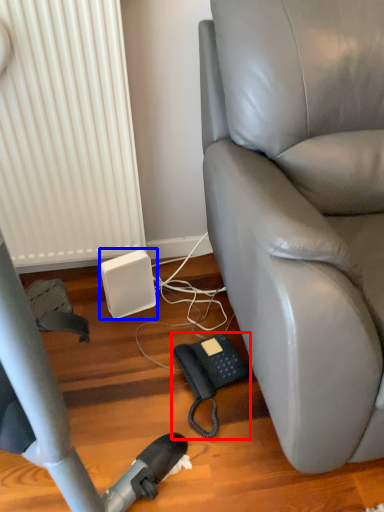
Question: Which object appears farthest to the camera in this image, corded phone (highlighted by a red box) or speaker (highlighted by a blue box)?

Choices:
 (A) corded phone
 (B) speaker

Answer: (B)